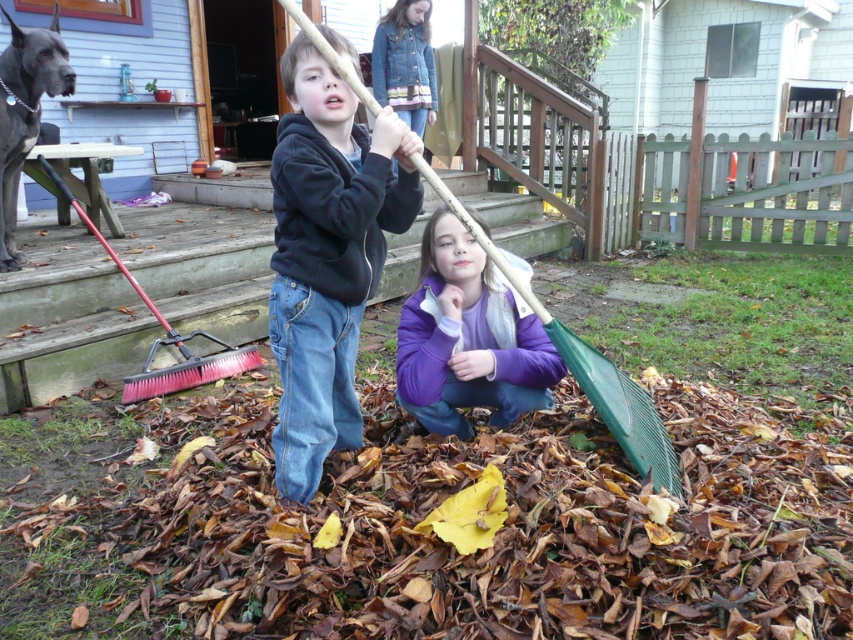
You are a parent trying to organize the backyard. You want to move the purple fleece jacket at lower center to the wooden porch at lower left so it doesn t get dirty. Is this possible based on their positions?

The wooden porch at lower left is located above the purple fleece jacket at lower center, so yes, you can move the purple fleece jacket at lower center onto the wooden porch at lower left since it is positioned below it and accessible.

You are a parent trying to organize the children in the backyard. You need to hand the pink bristle plastic broom at lower left to the child in the purple fleece jacket at lower center. Can you directly hand it to them without moving either object?

The purple fleece jacket at lower center is closer to the viewer than the pink bristle plastic broom at lower left, so the parent can directly hand the pink bristle plastic broom at lower left to the child in the purple fleece jacket at lower center without needing to move either object.